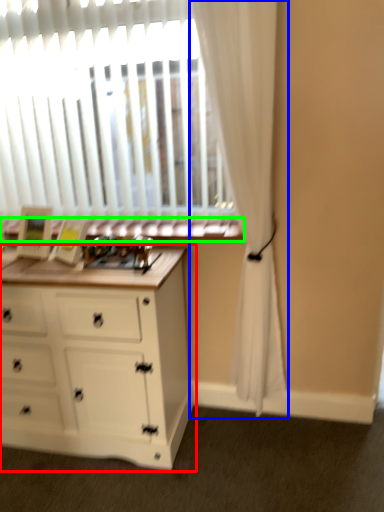
Question: Which object is positioned closest to chest of drawers (highlighted by a red box)? Select from curtain (highlighted by a blue box) and window sill (highlighted by a green box).

Choices:
 (A) curtain
 (B) window sill

Answer: (B)